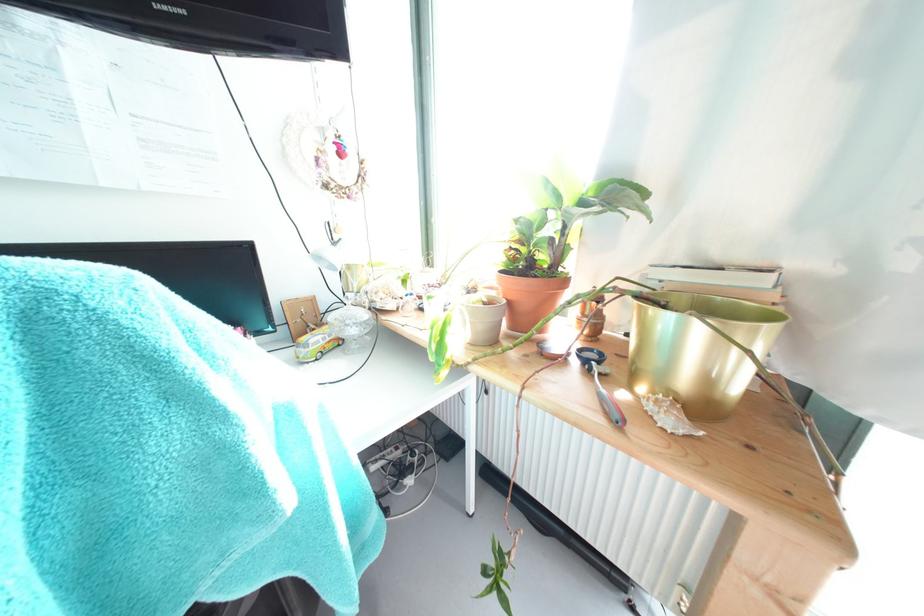
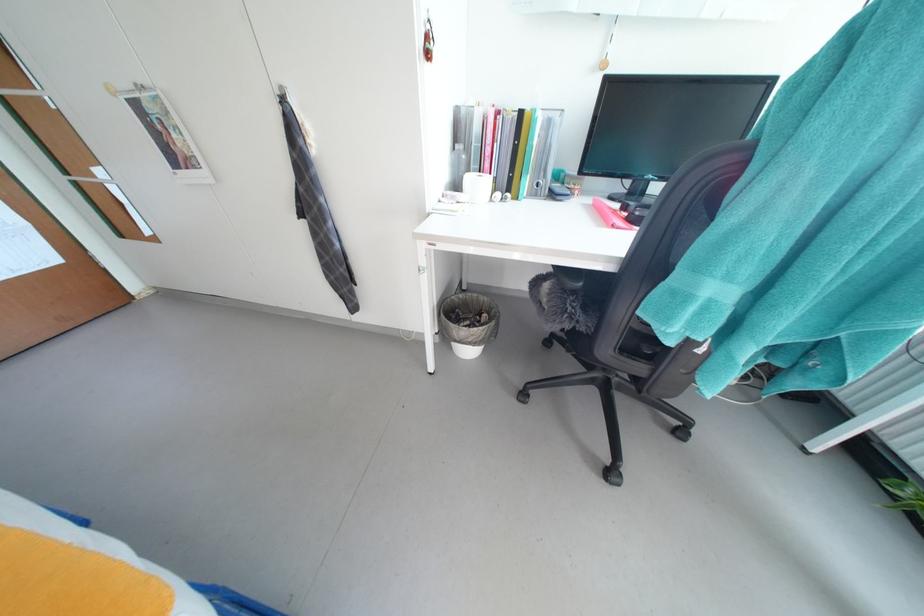
How did the camera likely rotate?

The camera's rotation is toward left-down.